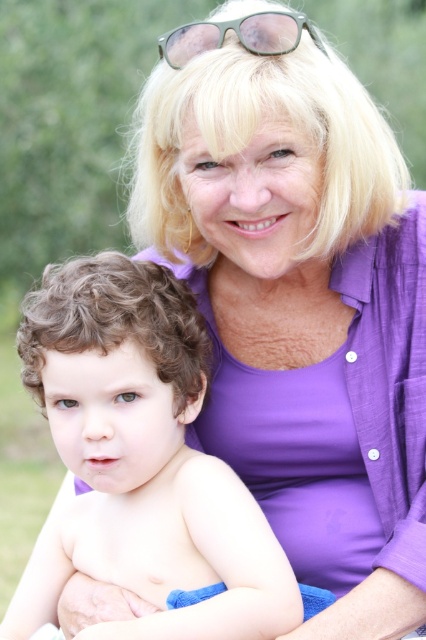
Question: Which object appears closest to the camera in this image?

Choices:
 (A) green matte sunglasses at upper center
 (B) curly hair at center

Answer: (B)

Question: Can you confirm if curly hair at center is wider than green matte sunglasses at upper center?

Choices:
 (A) no
 (B) yes

Answer: (B)

Question: Which point is closer to the camera taking this photo?

Choices:
 (A) (305, 17)
 (B) (233, 577)

Answer: (B)

Question: Can you confirm if curly hair at center is positioned to the right of green matte sunglasses at upper center?

Choices:
 (A) yes
 (B) no

Answer: (B)

Question: Is curly hair at center wider than green matte sunglasses at upper center?

Choices:
 (A) no
 (B) yes

Answer: (B)